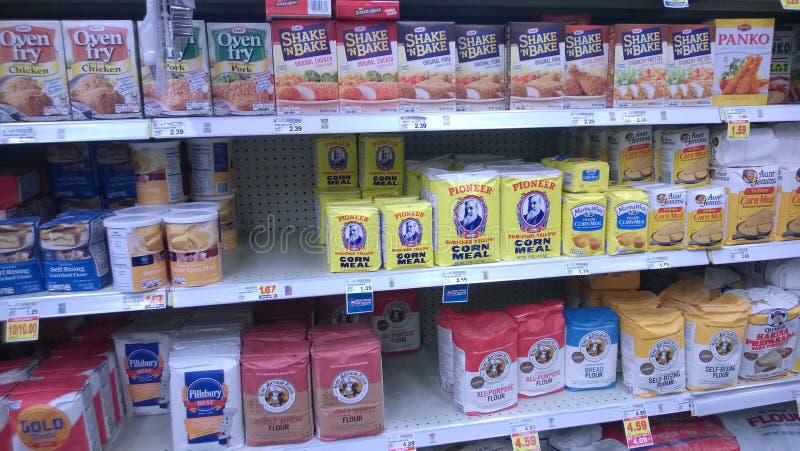
The image size is (800, 451). I want to click on shelf, so click(x=416, y=386).